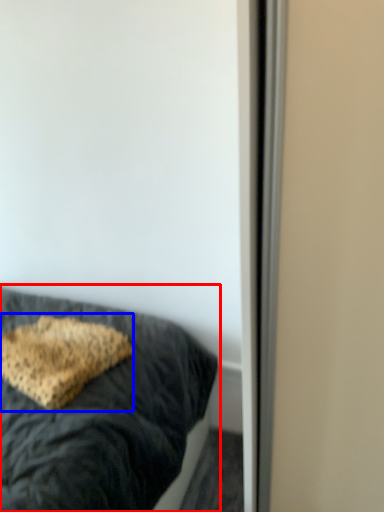
Question: Which of the following is the closest to the observer, bed (highlighted by a red box) or pillow (highlighted by a blue box)?

Choices:
 (A) bed
 (B) pillow

Answer: (A)